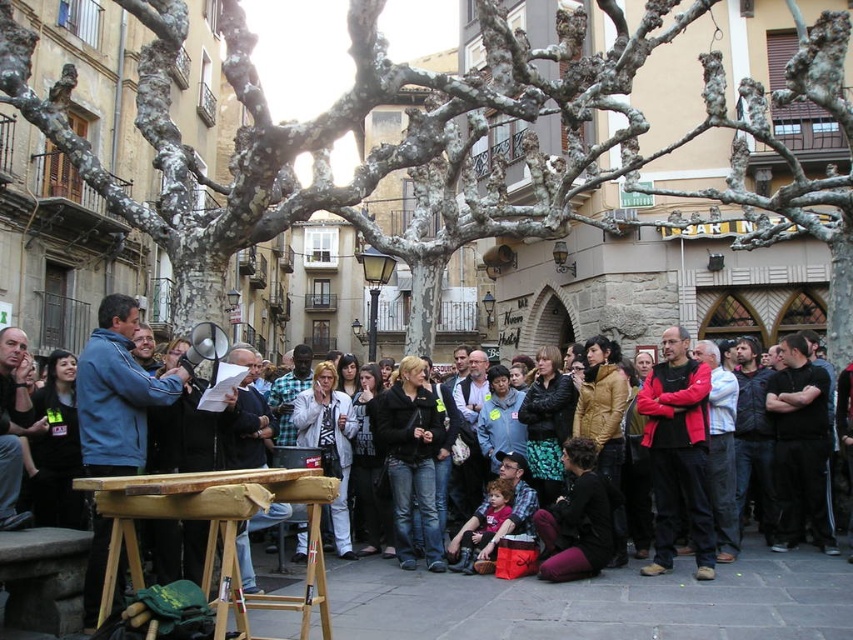
Is point (753, 589) positioned in front of point (682, 451)?

Yes, it is in front of point (682, 451).

Which is behind, point (508, 589) or point (709, 387)?

Positioned behind is point (709, 387).

Who is more distant from viewer, [788,568] or [663,508]?

The point [663,508] is more distant.

Find the location of a particular element. matte black jacket at center is located at coordinates (618, 586).

Is blue fleece jacket at left thinner than red fleece jacket at center?

No.

Is the position of blue fleece jacket at left less distant than that of red fleece jacket at center?

Yes, blue fleece jacket at left is closer to the viewer.

Locate an element on the screen. The image size is (853, 640). blue fleece jacket at left is located at coordinates (117, 392).

Is point (485, 38) positioned behind point (102, 420)?

That is True.

From the picture: Is gray bark tree at center to the right of blue fleece jacket at left from the viewer's perspective?

Indeed, gray bark tree at center is positioned on the right side of blue fleece jacket at left.

You are a GUI agent. You are given a task and a screenshot of the screen. Output one action in this format:
    pyautogui.click(x=<x>, y=<y>)
    Task: Click on the gray bark tree at center
    
    Given the screenshot: What is the action you would take?
    pyautogui.click(x=445, y=144)